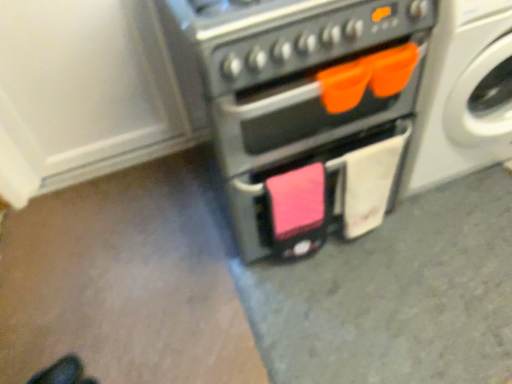
Question: From a real-world perspective, does white glossy washing machine at upper right sit lower than black leather shoes at lower left?

Choices:
 (A) yes
 (B) no

Answer: (B)

Question: Is white glossy washing machine at upper right turned away from black leather shoes at lower left?

Choices:
 (A) yes
 (B) no

Answer: (B)

Question: Can you confirm if white glossy washing machine at upper right is thinner than black leather shoes at lower left?

Choices:
 (A) no
 (B) yes

Answer: (A)

Question: From a real-world perspective, is white glossy washing machine at upper right positioned over black leather shoes at lower left based on gravity?

Choices:
 (A) yes
 (B) no

Answer: (A)

Question: Is white glossy washing machine at upper right bigger than black leather shoes at lower left?

Choices:
 (A) no
 (B) yes

Answer: (B)

Question: Can you see white glossy washing machine at upper right touching black leather shoes at lower left?

Choices:
 (A) no
 (B) yes

Answer: (A)

Question: Are matte black oven at center and black leather shoes at lower left located far from each other?

Choices:
 (A) yes
 (B) no

Answer: (A)

Question: Can you confirm if matte black oven at center is smaller than black leather shoes at lower left?

Choices:
 (A) yes
 (B) no

Answer: (B)

Question: Does matte black oven at center lie in front of black leather shoes at lower left?

Choices:
 (A) yes
 (B) no

Answer: (A)

Question: Is matte black oven at center aimed at black leather shoes at lower left?

Choices:
 (A) yes
 (B) no

Answer: (B)

Question: Is matte black oven at center shorter than black leather shoes at lower left?

Choices:
 (A) yes
 (B) no

Answer: (B)

Question: From a real-world perspective, is matte black oven at center located beneath black leather shoes at lower left?

Choices:
 (A) yes
 (B) no

Answer: (B)

Question: Does black leather shoes at lower left appear on the left side of white glossy washing machine at upper right?

Choices:
 (A) yes
 (B) no

Answer: (A)